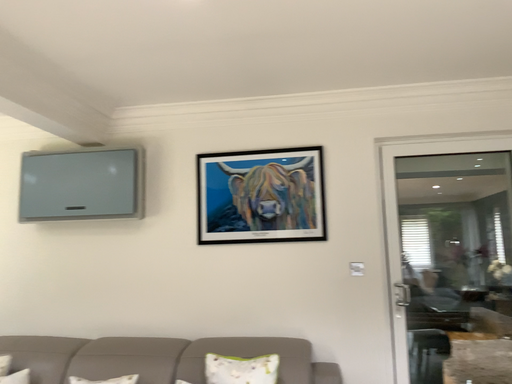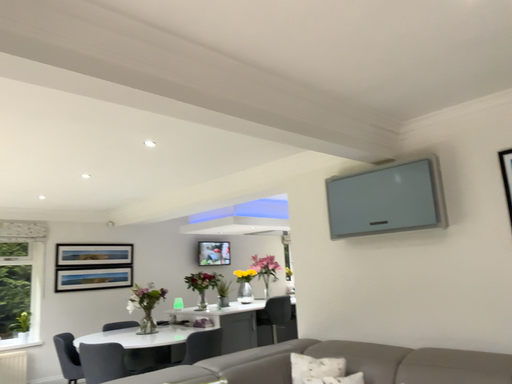
Question: Which way did the camera rotate in the video?

Choices:
 (A) rotated left
 (B) rotated right

Answer: (A)